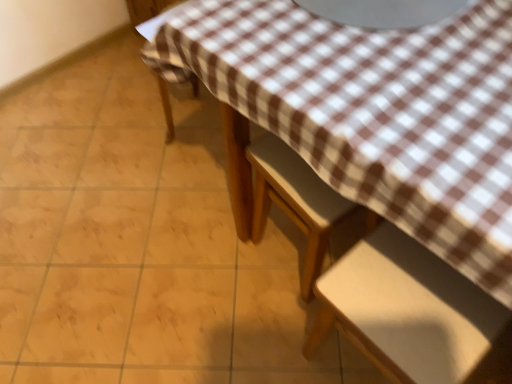
Where is `free region under brown checkered fabric at lower left, which is the first chair in top-to-bottom order (from a real-world perspective)`? This screenshot has width=512, height=384. free region under brown checkered fabric at lower left, which is the first chair in top-to-bottom order (from a real-world perspective) is located at coordinates (199, 129).